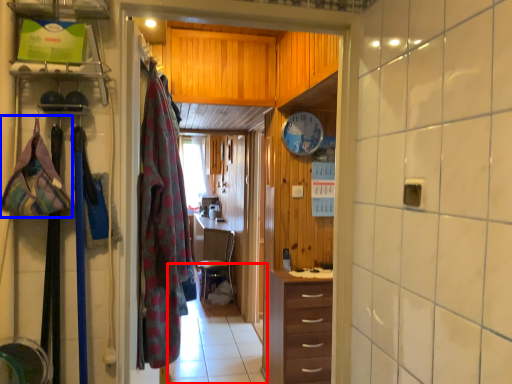
Question: Which of the following is the farthest to the observer, path (highlighted by a red box) or clothing (highlighted by a blue box)?

Choices:
 (A) path
 (B) clothing

Answer: (A)